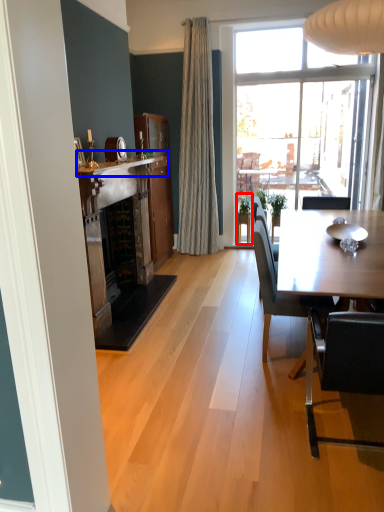
Question: Among these objects, which one is farthest to the camera, houseplant (highlighted by a red box) or mantle (highlighted by a blue box)?

Choices:
 (A) houseplant
 (B) mantle

Answer: (A)